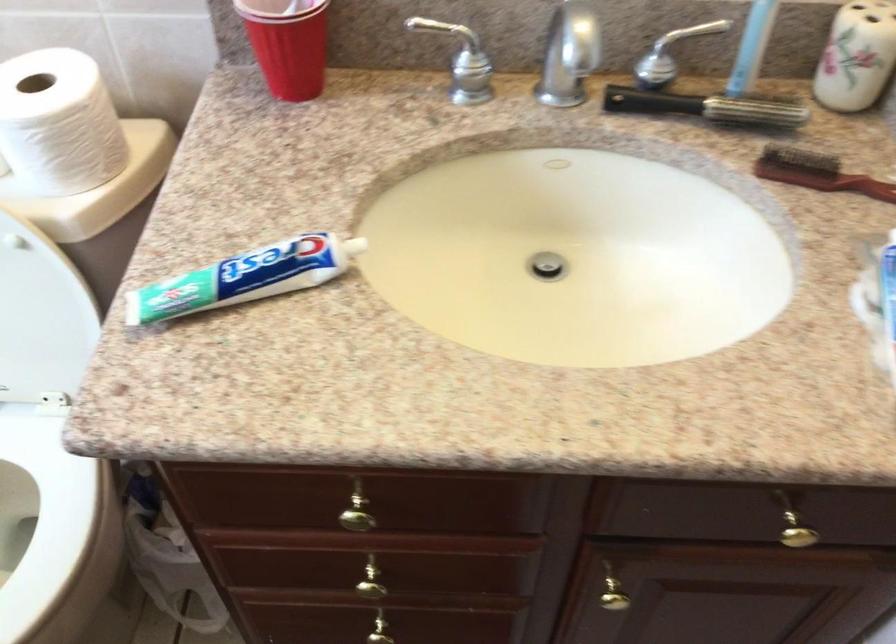
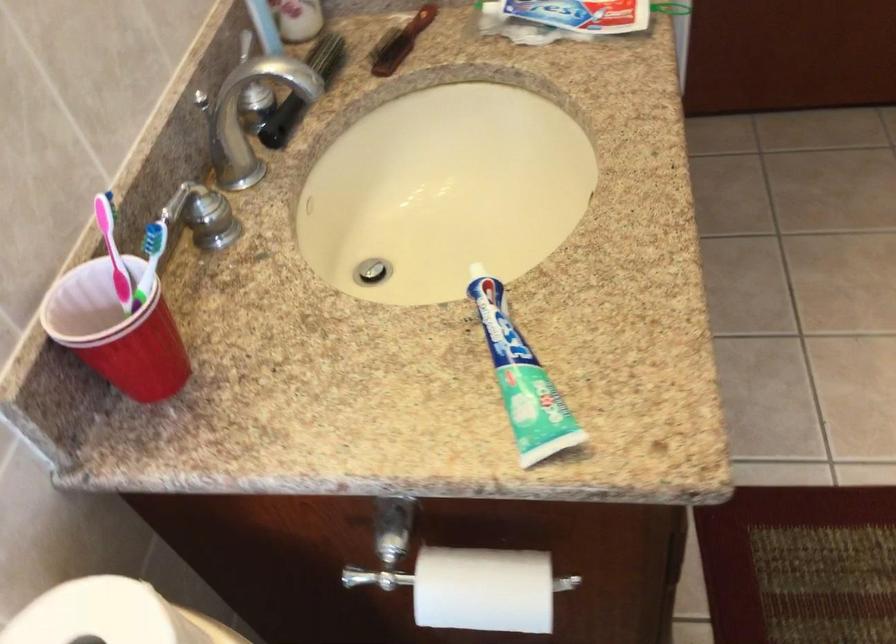
Find the pixel in the second image that matches [115,341] in the first image.

(483, 589)